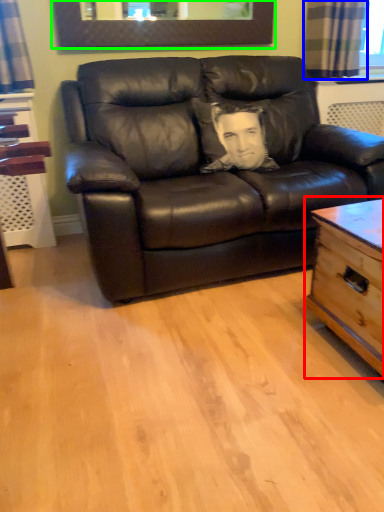
Question: Which object is the closest to the table (highlighted by a red box)? Choose among these: curtain (highlighted by a blue box) or picture frame (highlighted by a green box).

Choices:
 (A) curtain
 (B) picture frame

Answer: (A)